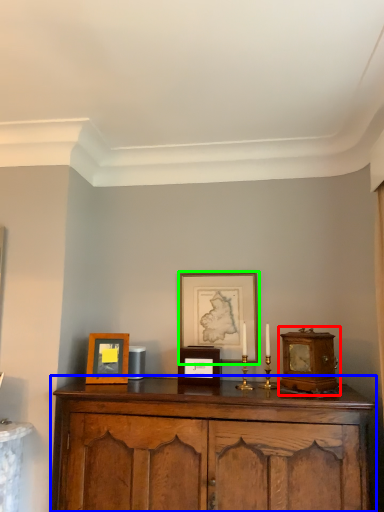
Question: Considering the real-world distances, which object is closest to alarm clock (highlighted by a red box)? cabinetry (highlighted by a blue box) or picture frame (highlighted by a green box).

Choices:
 (A) cabinetry
 (B) picture frame

Answer: (A)